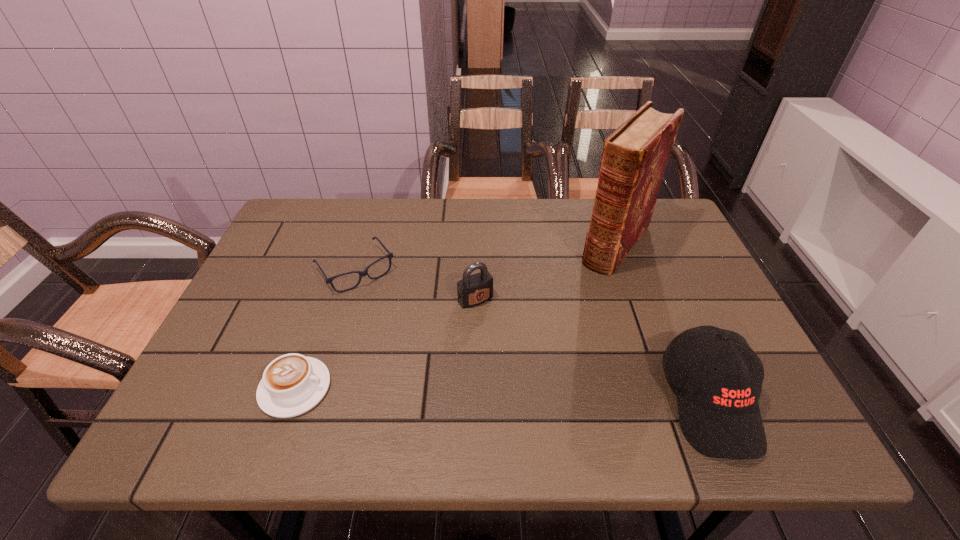
I want to click on spectacles at the left edge, so click(361, 273).

In order to click on baseball cap that is positioned at the right edge in this screenshot , I will do `click(719, 414)`.

Identify the location of hardback book that is at the right edge. (634, 158).

The height and width of the screenshot is (540, 960). I want to click on object at the far left corner, so click(x=361, y=273).

This screenshot has width=960, height=540. I want to click on object that is at the near left corner, so click(292, 384).

Find the location of a particular element. This screenshot has width=960, height=540. object present at the far right corner is located at coordinates (634, 158).

In order to click on object present at the near right corner in this screenshot , I will do click(719, 414).

In the image, there is a desktop. Identify the location of vacant space at the far edge. (332, 234).

Image resolution: width=960 pixels, height=540 pixels. In the image, there is a desktop. In order to click on vacant area at the left edge in this screenshot , I will do `click(278, 288)`.

This screenshot has width=960, height=540. Identify the location of vacant position at the right edge of the desktop. (691, 299).